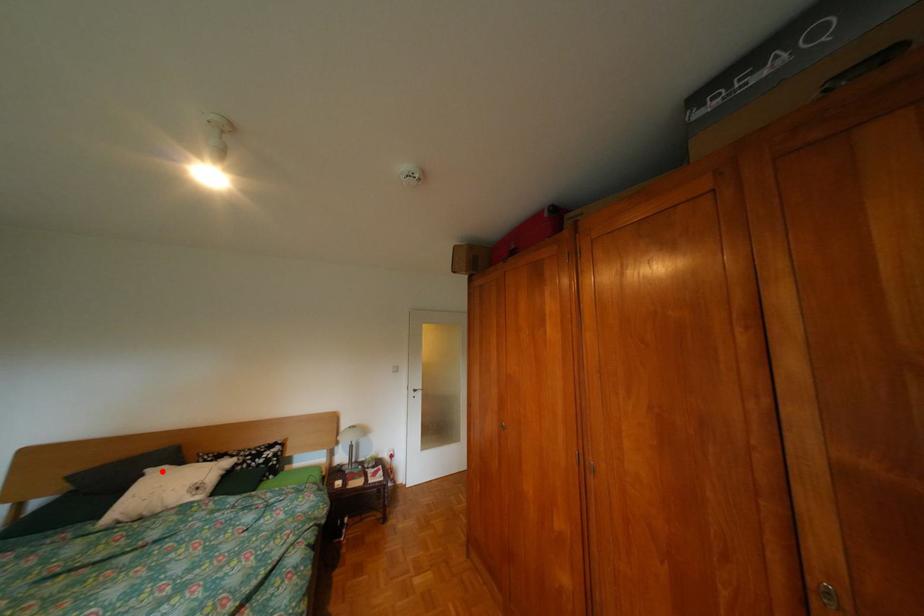
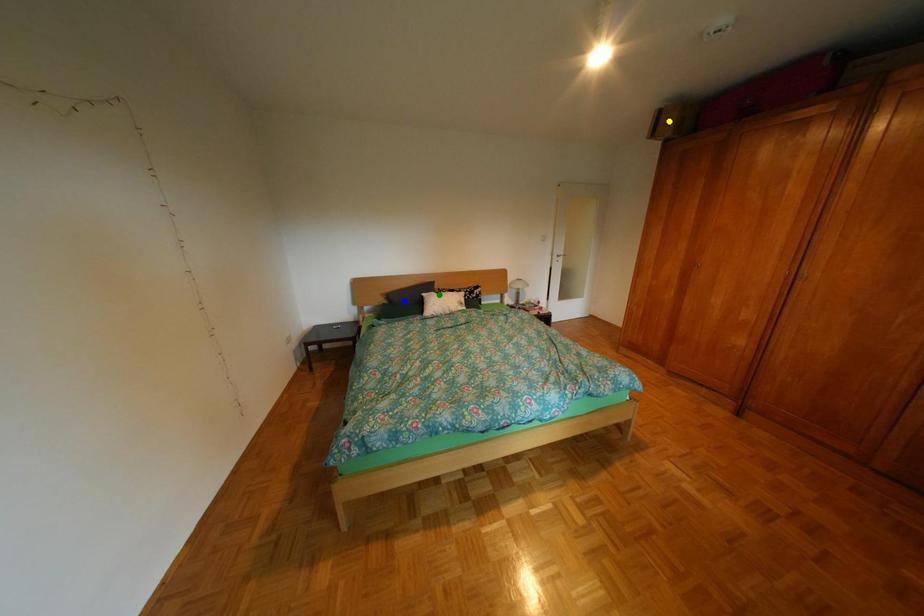
Question: I am providing you with two images of the same scene from different viewpoints. A red point is marked on the first image. You are given multiple points on the second image. Which point in image 2 represents the same 3d spot as the red point in image 1?

Choices:
 (A) blue point
 (B) yellow point
 (C) green point

Answer: (C)